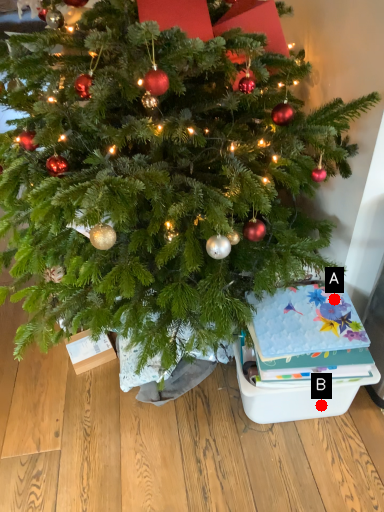
Question: Two points are circled on the image, labeled by A and B beside each circle. Which point is closer to the camera?

Choices:
 (A) A is closer
 (B) B is closer

Answer: (A)